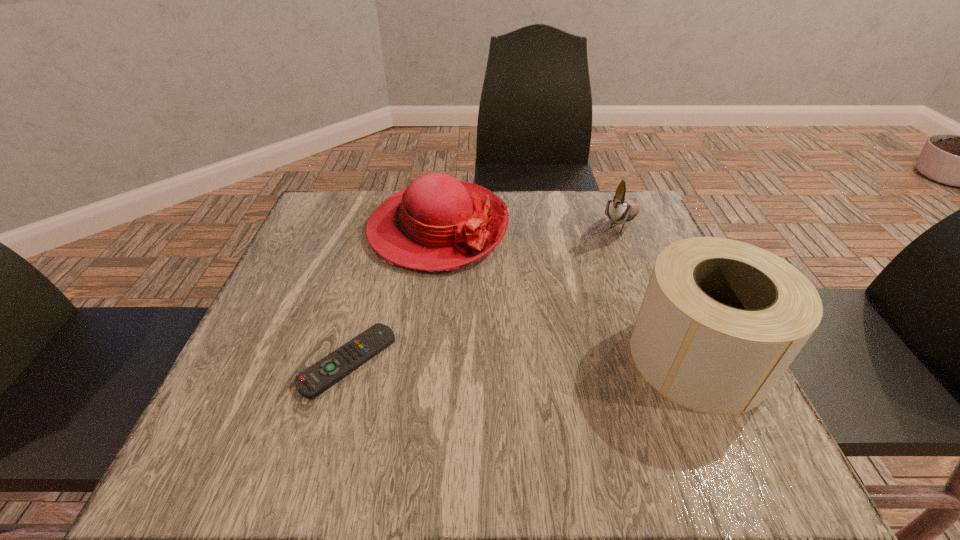
Locate an element on the screen. The width and height of the screenshot is (960, 540). object that is at the far left corner is located at coordinates (437, 223).

The image size is (960, 540). What are the coordinates of `object positioned at the near left corner` in the screenshot? It's located at (316, 379).

Identify the location of object at the far right corner. The height and width of the screenshot is (540, 960). (619, 210).

Find the location of a particular element. object that is at the near right corner is located at coordinates (721, 320).

What are the coordinates of `vacant space at the far edge` in the screenshot? It's located at (551, 226).

You are a GUI agent. You are given a task and a screenshot of the screen. Output one action in this format:
    pyautogui.click(x=<x>, y=<y>)
    Task: Click on the free space at the near edge
    Image resolution: width=960 pixels, height=540 pixels.
    Given the screenshot: What is the action you would take?
    pyautogui.click(x=493, y=421)

Locate an element on the screen. This screenshot has height=540, width=960. vacant space at the left edge of the desktop is located at coordinates (318, 351).

This screenshot has width=960, height=540. Find the location of `vacant space at the right edge of the desktop`. vacant space at the right edge of the desktop is located at coordinates (642, 276).

Find the location of a particular element. vacant region at the far left corner of the desktop is located at coordinates (324, 218).

In the image, there is a desktop. Find the location of `vacant space at the near right corner`. vacant space at the near right corner is located at coordinates (683, 408).